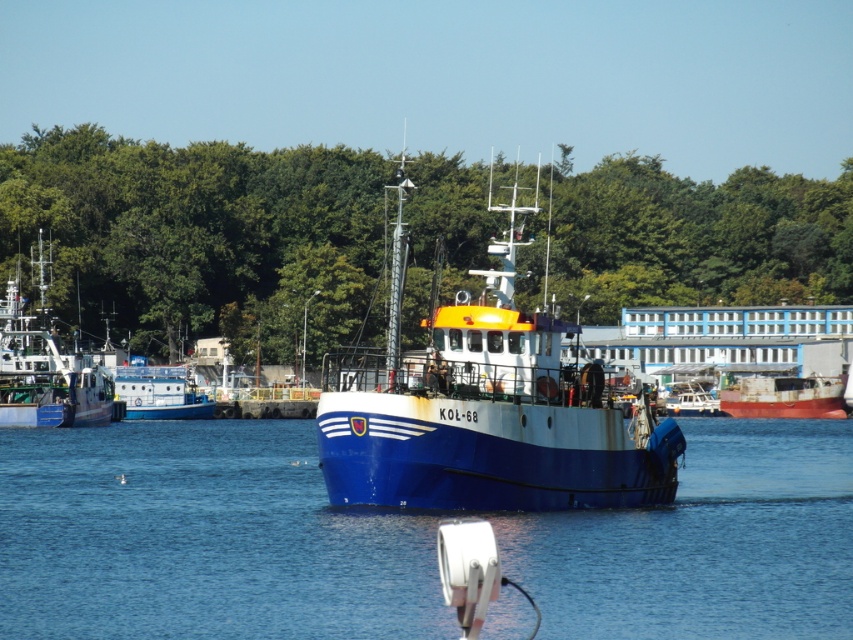
Question: Is rusty metal ship at lower right further to camera compared to blue matte boat at left?

Choices:
 (A) yes
 (B) no

Answer: (A)

Question: Does blue water at center have a smaller size compared to blue matte fishing boat at left?

Choices:
 (A) yes
 (B) no

Answer: (A)

Question: Which object is positioned closest to the blue matte boat at center?

Choices:
 (A) blue matte boat at left
 (B) blue matte fishing boat at left
 (C) rusty metal ship at lower right
 (D) blue water at center

Answer: (D)

Question: Which object is closer to the camera taking this photo?

Choices:
 (A) blue matte boat at center
 (B) rusty metal ship at lower right
 (C) blue matte boat at left
 (D) green leafy trees at upper center

Answer: (A)

Question: Based on their relative distances, which object is nearer to the green leafy trees at upper center?

Choices:
 (A) rusty metal ship at lower right
 (B) blue water at center
 (C) blue matte boat at left

Answer: (A)

Question: Does rusty metal ship at lower right have a larger size compared to blue matte boat at left?

Choices:
 (A) no
 (B) yes

Answer: (A)